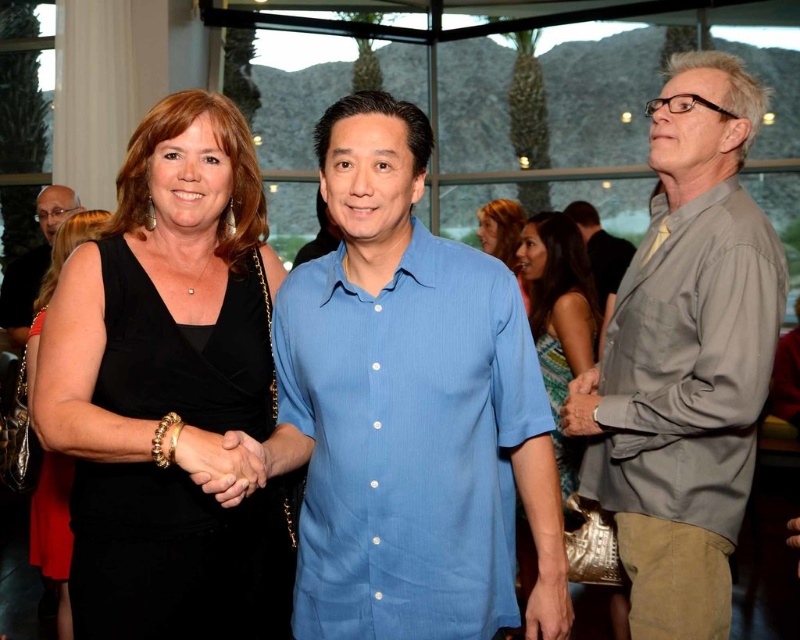
Which is behind, point (413, 253) or point (722, 307)?

The point (722, 307) is more distant.

Between blue linen shirt at center and gray cotton shirt at right, which one has less height?

blue linen shirt at center is shorter.

Does point (368, 349) lie behind point (632, 477)?

No, (368, 349) is closer to viewer.

Image resolution: width=800 pixels, height=640 pixels. In order to click on blue linen shirt at center in this screenshot , I will do `click(408, 442)`.

Is black satin dress at left positioned at the back of matte black glasses at upper left?

No, it is in front of matte black glasses at upper left.

This screenshot has height=640, width=800. Find the location of `black satin dress at left`. black satin dress at left is located at coordinates (54, 531).

Is point (58, 632) farther from viewer compared to point (52, 211)?

No, (58, 632) is closer to viewer.

You are a GUI agent. You are given a task and a screenshot of the screen. Output one action in this format:
    pyautogui.click(x=<x>, y=<y>)
    Task: Click on the black satin dress at left
    Image resolution: width=800 pixels, height=640 pixels.
    Given the screenshot: What is the action you would take?
    pyautogui.click(x=54, y=531)

Between point (144, 310) and point (508, 246), which one is positioned behind?

The point (508, 246) is more distant.

Is black velvet dress at center smaller than matte black dress at center?

No, black velvet dress at center is not smaller than matte black dress at center.

Locate an element on the screen. The image size is (800, 640). black velvet dress at center is located at coordinates (170, 390).

Locate an element on the screen. The height and width of the screenshot is (640, 800). black velvet dress at center is located at coordinates (170, 390).